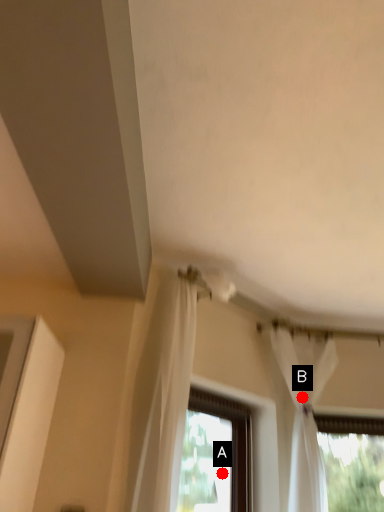
Question: Two points are circled on the image, labeled by A and B beside each circle. Which of the following is the farthest from the observer?

Choices:
 (A) A is further
 (B) B is further

Answer: (A)